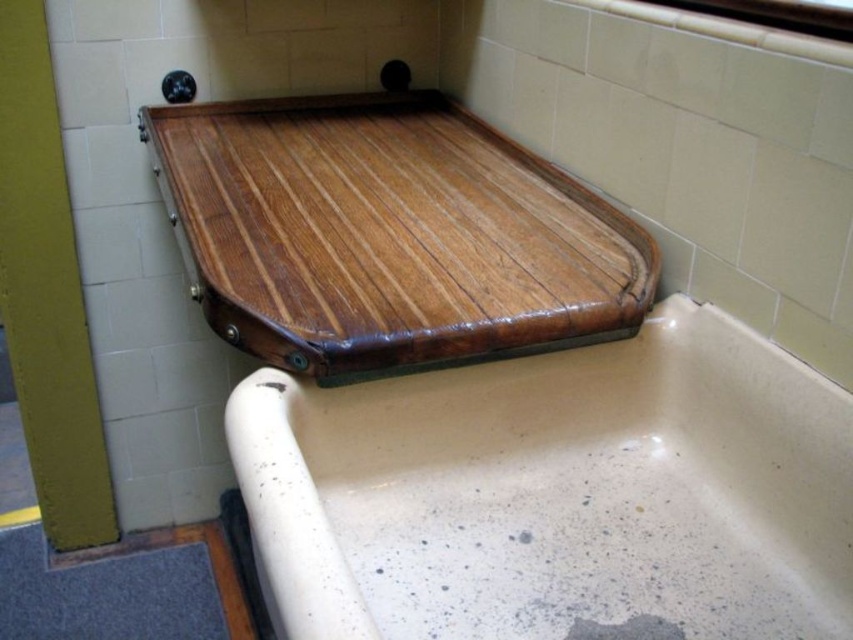
Question: Observing the image, what is the correct spatial positioning of speckled ceramic bathtub at upper center in reference to wooden tray at upper center?

Choices:
 (A) above
 (B) below

Answer: (B)

Question: Is the position of speckled ceramic bathtub at upper center more distant than that of wooden tray at upper center?

Choices:
 (A) yes
 (B) no

Answer: (B)

Question: Can you confirm if speckled ceramic bathtub at upper center is positioned above wooden tray at upper center?

Choices:
 (A) yes
 (B) no

Answer: (B)

Question: Which point appears closest to the camera in this image?

Choices:
 (A) (526, 333)
 (B) (642, 616)

Answer: (B)

Question: Which of the following is the closest to the observer?

Choices:
 (A) (776, 476)
 (B) (424, 230)

Answer: (A)

Question: Which object appears closest to the camera in this image?

Choices:
 (A) speckled ceramic bathtub at upper center
 (B) wooden tray at upper center

Answer: (A)